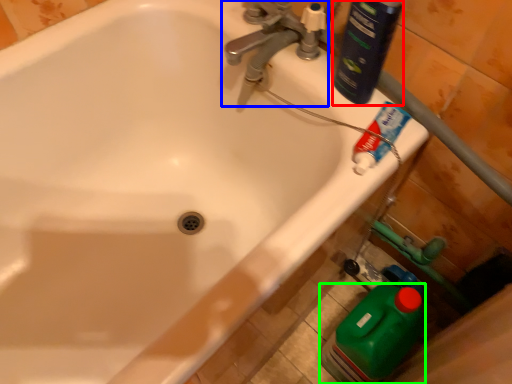
Question: Based on their relative distances, which object is nearer to cleaning product (highlighted by a red box)? Choose from tap (highlighted by a blue box) and cleaning product (highlighted by a green box).

Choices:
 (A) tap
 (B) cleaning product

Answer: (A)